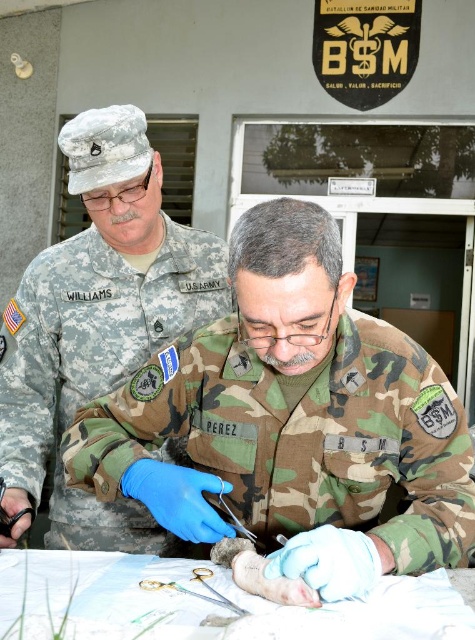
You are a medic in a military operation. You need to quickly locate the gold metallic scissors at center to cut a bandage. However, you are currently looking at the camouflage uniform at center. Which direction should you move your eyes to find the scissors?

The gold metallic scissors at center are below the camouflage uniform at center, so you should move your eyes downward to locate them.

In the scene where two military personnel are conducting a medical procedure, you need to determine which object is taller between the camouflage uniform at center and the gold metallic scissors at center. Based on the description, which one is taller?

The camouflage uniform at center is taller than the gold metallic scissors at center according to the description.

You are a drone operator controlling a drone that needs to hover exactly 36 inches above the ground. If the point at coordinates point (450, 513) is your target, can you confirm if the drone is at the correct height?

The distance between point (450, 513) and the camera is 36.56 inches. Since the drone needs to hover at 36 inches, it is slightly too high by 0.56 inches.